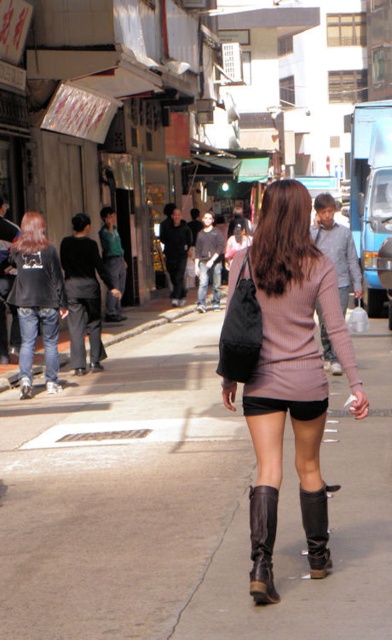
Question: Observing the image, what is the correct spatial positioning of brown concrete pavement at center in reference to leather boots at lower center?

Choices:
 (A) above
 (B) below

Answer: (A)

Question: Which point is closer to the camera taking this photo?

Choices:
 (A) (310, 493)
 (B) (317, 257)
 (C) (295, 426)
 (D) (41, 220)

Answer: (B)

Question: Which of the following is the farthest from the observer?

Choices:
 (A) (304, 326)
 (B) (313, 516)
 (C) (215, 433)

Answer: (C)

Question: Considering the relative positions of brown concrete pavement at center and matte black jacket at left in the image provided, where is brown concrete pavement at center located with respect to matte black jacket at left?

Choices:
 (A) right
 (B) left

Answer: (A)

Question: Is matte pink sweater at center above pale pink sweater at center?

Choices:
 (A) yes
 (B) no

Answer: (B)

Question: Which object is the closest to the brown concrete pavement at center?

Choices:
 (A) brown leather boot at lower center
 (B) leather boots at lower center
 (C) matte pink sweater at center

Answer: (B)